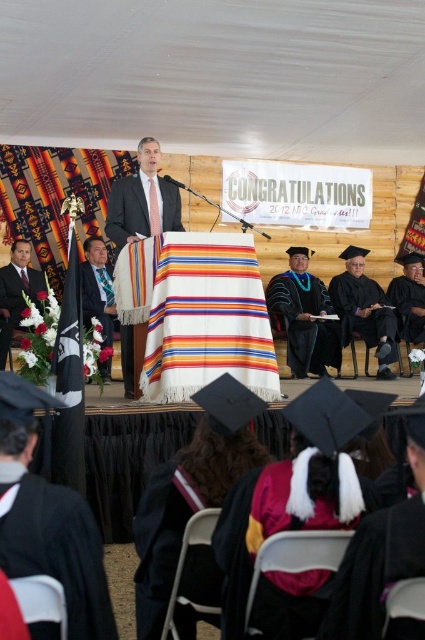
You are a photographer at the graduation ceremony. You want to capture a photo of the matte black suit at left and the black matte graduation gown at center. Can you position yourself so that both subjects are visible in the frame without any obstruction? Explain your reasoning.

The matte black suit at left is behind the black matte graduation gown at center, so positioning yourself in front of both subjects would allow you to see both. However, if the graduation gown is directly blocking the view of the suit, you might need to adjust your angle to ensure both are visible without obstruction.

You are a photographer at the graduation ceremony. You need to capture a photo where both the black matte graduation gown at center and the matte black suit at left are visible. Based on their positions, which one should be placed closer to the bottom of the photo frame?

The black matte graduation gown at center should be placed closer to the bottom of the photo frame because it is positioned below the matte black suit at left in the scene.

You are a photographer at the graduation ceremony. You want to capture a photo of the velvet burgundy gown at lower center. According to the coordinates provided, where should you focus your camera?

The velvet burgundy gown at lower center is located at coordinates point (374, 570), so you should focus your camera there.